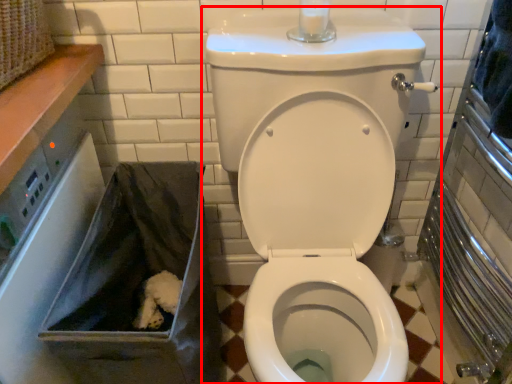
Question: In this image, where is toilet (annotated by the red box) located relative to recycling bin?

Choices:
 (A) right
 (B) left

Answer: (A)